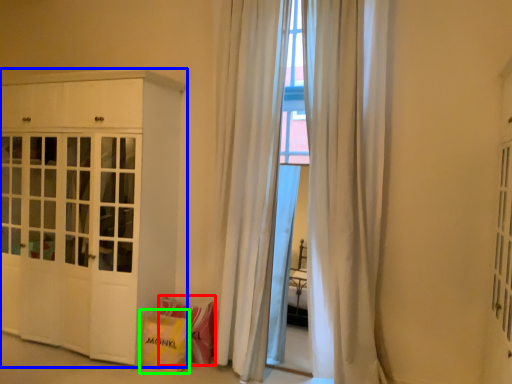
Question: Estimate the real-world distances between objects in this image. Which object is closer to shopping bag (highlighted by a red box), cabinetry (highlighted by a blue box) or shopping bag (highlighted by a green box)?

Choices:
 (A) cabinetry
 (B) shopping bag

Answer: (B)